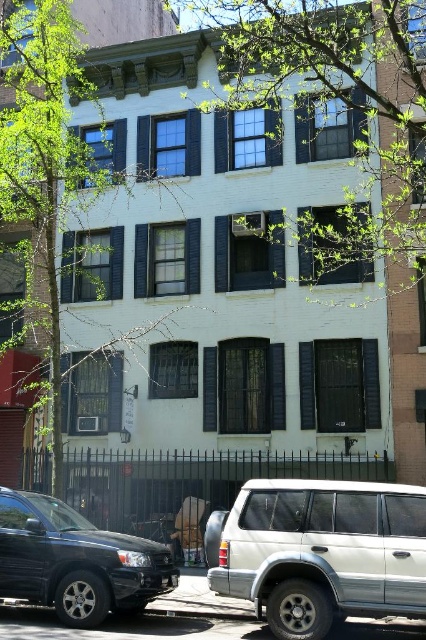
You are a photographer planning to take a photo of the three story brick building with a white facade and dark blue shutters. You want to ensure that both the green leafy tree at center and the metallic silver minivan at center are visible in the frame. Which object should you focus on to ensure both are in the shot?

The green leafy tree at center is larger in size than the metallic silver minivan at center. To ensure both are visible in the shot, focus on the larger object, the green leafy tree at center, as it will require more space in the frame.

You are standing in front of the three story brick building and want to determine which of the two green leafy trees is closer to you. The trees are the green leafy tree at center and the green leafy tree at upper left. Based on their sizes, which one is closer?

The green leafy tree at center has a larger size compared to the green leafy tree at upper left, so the green leafy tree at center is closer to you because larger objects appear closer in the scene.

You are standing in front of the building and want to take a photo of the shiny black suv at lower left without any obstructions. Is the green leafy tree at upper left blocking your view?

The shiny black suv at lower left is behind the green leafy tree at upper left, so the tree is blocking the view of the suv.